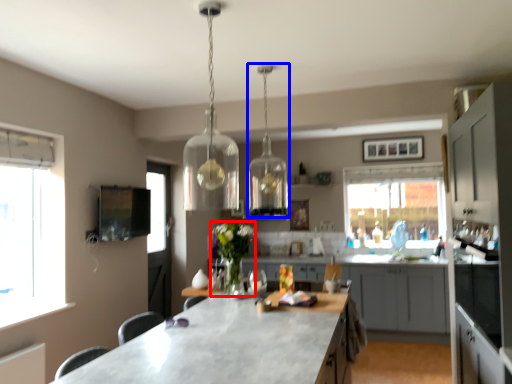
Question: Which object appears farthest to the camera in this image, flower (highlighted by a red box) or lamp (highlighted by a blue box)?

Choices:
 (A) flower
 (B) lamp

Answer: (A)